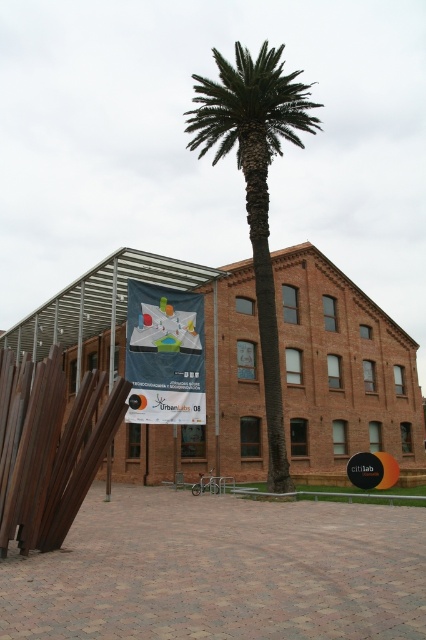
Who is positioned more to the right, green leafy palm at center or smooth metal pole at center?

green leafy palm at center

Looking at this image, does green leafy palm at center have a larger size compared to smooth metal pole at center?

Yes.

This screenshot has width=426, height=640. What are the coordinates of `green leafy palm at center` in the screenshot? It's located at (256, 186).

At what (x,y) coordinates should I click in order to perform the action: click on green leafy palm at center. Please return your answer as a coordinate pair (x, y). Looking at the image, I should click on (256, 186).

Consider the image. Who is shorter, green leafy palm at center or brushed metal pole at left?

brushed metal pole at left

From the picture: Is green leafy palm at center taller than brushed metal pole at left?

Indeed, green leafy palm at center has a greater height compared to brushed metal pole at left.

Describe the element at coordinates (256, 186) in the screenshot. The image size is (426, 640). I see `green leafy palm at center` at that location.

Identify the location of green leafy palm at center. This screenshot has width=426, height=640. (256, 186).

Which is more to the left, brushed metal pole at left or smooth metal pole at center?

brushed metal pole at left

Which is in front, point (112, 364) or point (218, 449)?

Positioned in front is point (112, 364).

Locate an element on the screen. The height and width of the screenshot is (640, 426). brushed metal pole at left is located at coordinates (112, 324).